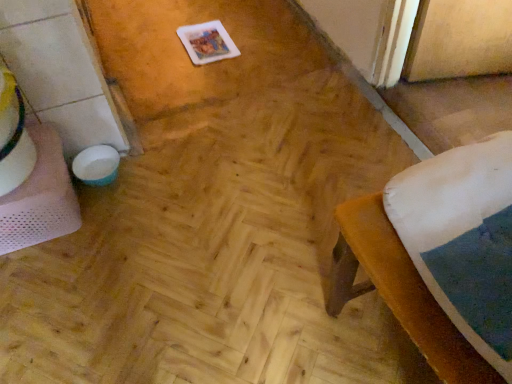
Question: From a real-world perspective, is brown fabric stool at lower right physically located above or below white mesh table at left?

Choices:
 (A) below
 (B) above

Answer: (B)

Question: Is brown fabric stool at lower right in front of or behind white mesh table at left in the image?

Choices:
 (A) behind
 (B) front

Answer: (B)

Question: Would you say brown fabric stool at lower right is to the left or to the right of white mesh table at left in the picture?

Choices:
 (A) left
 (B) right

Answer: (B)

Question: Relative to brown fabric stool at lower right, is white mesh table at left in front or behind?

Choices:
 (A) front
 (B) behind

Answer: (B)

Question: Is white mesh table at left taller or shorter than brown fabric stool at lower right?

Choices:
 (A) tall
 (B) short

Answer: (B)

Question: Based on their positions, is white mesh table at left located to the left or right of brown fabric stool at lower right?

Choices:
 (A) left
 (B) right

Answer: (A)

Question: From a real-world perspective, is white mesh table at left above or below brown fabric stool at lower right?

Choices:
 (A) above
 (B) below

Answer: (B)